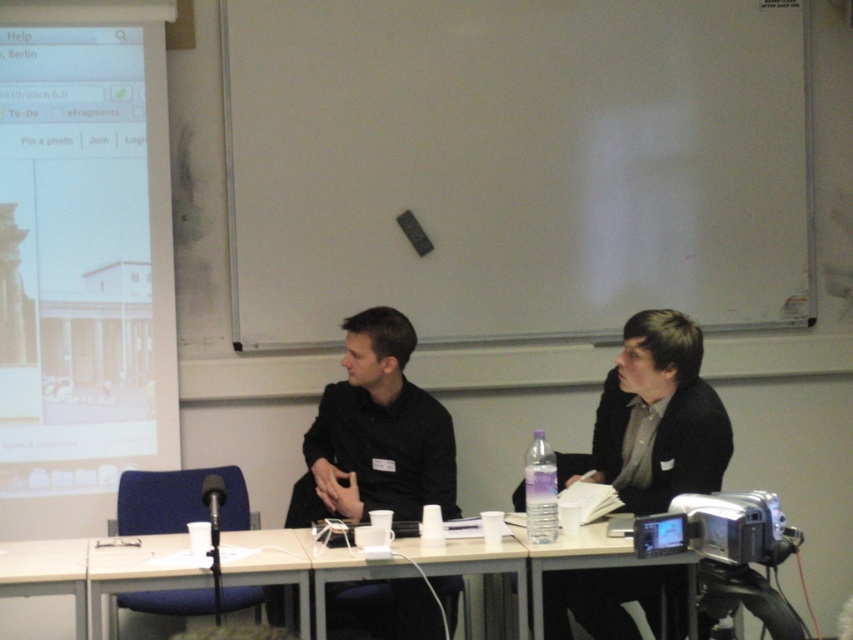
Question: Which point is closer to the camera taking this photo?

Choices:
 (A) (434, 566)
 (B) (711, 497)
 (C) (1, 385)

Answer: (B)

Question: Is black matte shirt at center thinner than silver metallic projector at lower right?

Choices:
 (A) yes
 (B) no

Answer: (B)

Question: Can you confirm if white matte projector screen at upper left is wider than transparent plastic table at center?

Choices:
 (A) no
 (B) yes

Answer: (A)

Question: In this image, where is white plastic table at center located relative to silver metallic projector at lower right?

Choices:
 (A) above
 (B) below

Answer: (B)

Question: Which point is closer to the camera?

Choices:
 (A) black matte shirt at center
 (B) transparent plastic table at center
 (C) white plastic cup at lower center
 (D) white plastic table at lower left

Answer: (B)

Question: Which object is farther from the camera taking this photo?

Choices:
 (A) black matte shirt at center
 (B) white plastic table at lower left
 (C) silver metallic projector at lower right
 (D) white plastic table at center

Answer: (A)